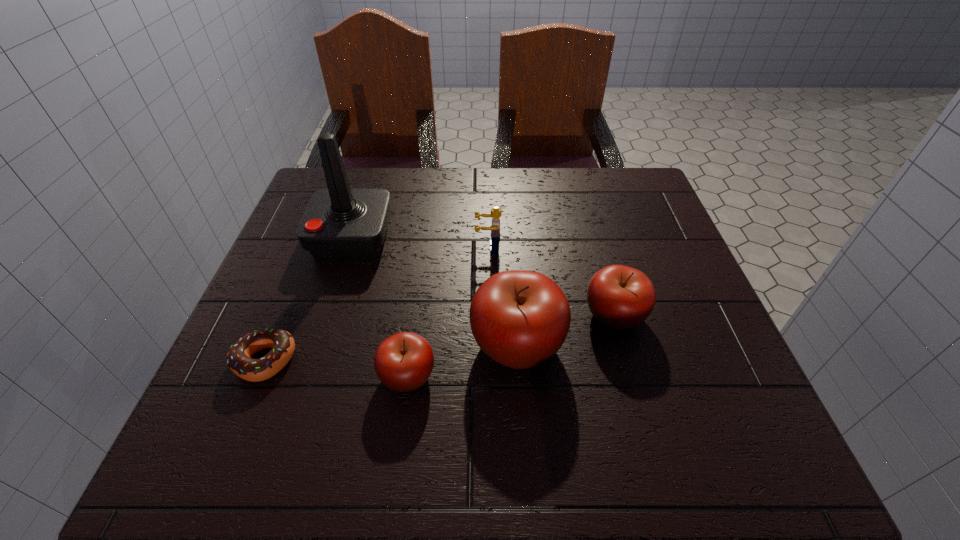
Find the location of a particular element. This screenshot has height=540, width=960. joystick at the left edge is located at coordinates (339, 222).

This screenshot has width=960, height=540. I want to click on object located at the right edge, so click(620, 297).

Image resolution: width=960 pixels, height=540 pixels. In order to click on object at the far left corner in this screenshot , I will do point(339,222).

At what (x,y) coordinates should I click in order to perform the action: click on object located in the near left corner section of the desktop. Please return your answer as a coordinate pair (x, y). The image size is (960, 540). Looking at the image, I should click on (239, 360).

In the image, there is a desktop. Where is `vacant area at the far edge`? The width and height of the screenshot is (960, 540). vacant area at the far edge is located at coordinates (562, 209).

In the image, there is a desktop. What are the coordinates of `vacant region at the near edge` in the screenshot? It's located at (631, 403).

What are the coordinates of `vacant space at the left edge of the desktop` in the screenshot? It's located at (293, 323).

Locate an element on the screen. The width and height of the screenshot is (960, 540). free space at the right edge of the desktop is located at coordinates (716, 321).

In the image, there is a desktop. Where is `free space at the far left corner`? The height and width of the screenshot is (540, 960). free space at the far left corner is located at coordinates (356, 172).

In the image, there is a desktop. Find the location of `free space at the far right corner`. free space at the far right corner is located at coordinates (592, 179).